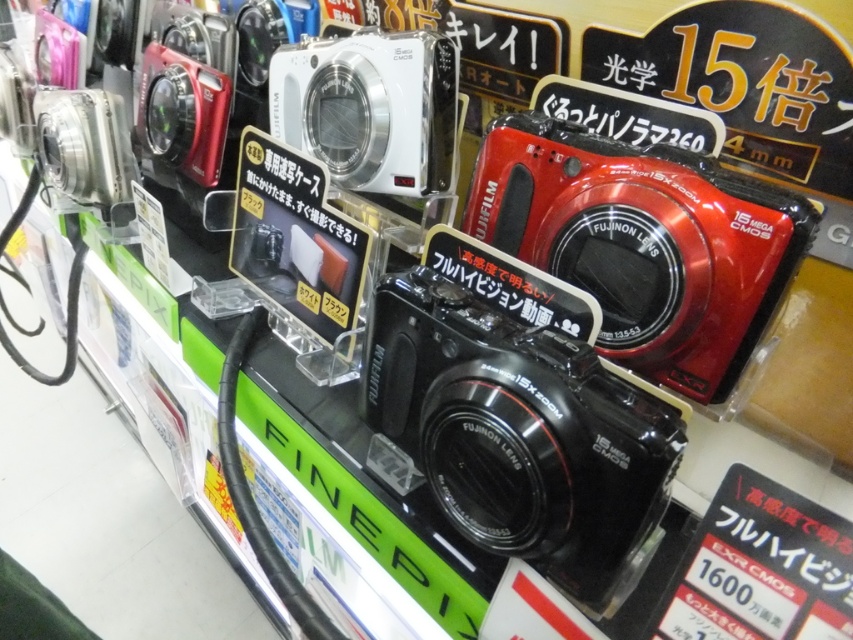
Who is taller, satin silver camera at left or matte black camera at upper left?

With more height is matte black camera at upper left.

Where is `satin silver camera at left`? This screenshot has width=853, height=640. satin silver camera at left is located at coordinates (86, 148).

Based on the photo, does shiny red plastic camera at upper right appear on the left side of white plastic camera at upper center?

Incorrect, shiny red plastic camera at upper right is not on the left side of white plastic camera at upper center.

Which of these two, shiny red plastic camera at upper right or white plastic camera at upper center, stands shorter?

white plastic camera at upper center

Does point (746, 188) come in front of point (346, 157)?

Yes.

The height and width of the screenshot is (640, 853). In order to click on shiny red plastic camera at upper right in this screenshot , I will do `click(643, 243)`.

Who is lower down, shiny red plastic camera at upper right or satin silver camera at left?

shiny red plastic camera at upper right is lower down.

Is point (646, 275) less distant than point (80, 196)?

Yes, it is in front of point (80, 196).

Identify the location of shiny red plastic camera at upper right. (643, 243).